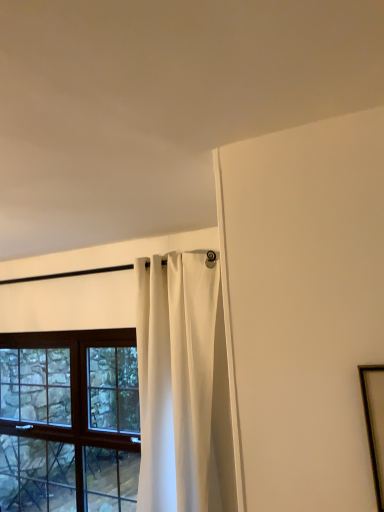
Question: Can you confirm if wooden-framed window at left is smaller than wooden picture frame at right?

Choices:
 (A) no
 (B) yes

Answer: (A)

Question: Are wooden-framed window at left and wooden picture frame at right located far from each other?

Choices:
 (A) no
 (B) yes

Answer: (B)

Question: Can you confirm if wooden-framed window at left is positioned to the right of wooden picture frame at right?

Choices:
 (A) no
 (B) yes

Answer: (A)

Question: From a real-world perspective, is wooden-framed window at left located beneath wooden picture frame at right?

Choices:
 (A) yes
 (B) no

Answer: (A)

Question: Considering the relative sizes of wooden-framed window at left and wooden picture frame at right in the image provided, is wooden-framed window at left wider than wooden picture frame at right?

Choices:
 (A) yes
 (B) no

Answer: (A)

Question: Can you confirm if wooden-framed window at left is taller than wooden picture frame at right?

Choices:
 (A) no
 (B) yes

Answer: (B)

Question: From a real-world perspective, is wooden-framed window at left physically above white matte curtain at upper center?

Choices:
 (A) yes
 (B) no

Answer: (B)

Question: Does wooden-framed window at left have a lesser width compared to white matte curtain at upper center?

Choices:
 (A) no
 (B) yes

Answer: (B)

Question: Can you confirm if wooden-framed window at left is smaller than white matte curtain at upper center?

Choices:
 (A) yes
 (B) no

Answer: (B)

Question: Is wooden-framed window at left taller than white matte curtain at upper center?

Choices:
 (A) no
 (B) yes

Answer: (A)

Question: Is wooden-framed window at left outside of white matte curtain at upper center?

Choices:
 (A) no
 (B) yes

Answer: (B)

Question: Is white matte curtain at upper center located within wooden-framed window at left?

Choices:
 (A) no
 (B) yes

Answer: (A)

Question: Does white matte curtain at upper center appear on the right side of wooden-framed window at left?

Choices:
 (A) no
 (B) yes

Answer: (B)